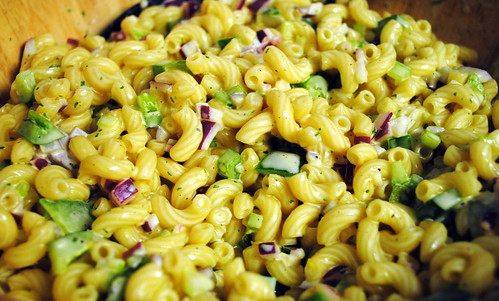
What are the coordinates of `food area in the bottom right corner` in the screenshot? It's located at (485, 275).